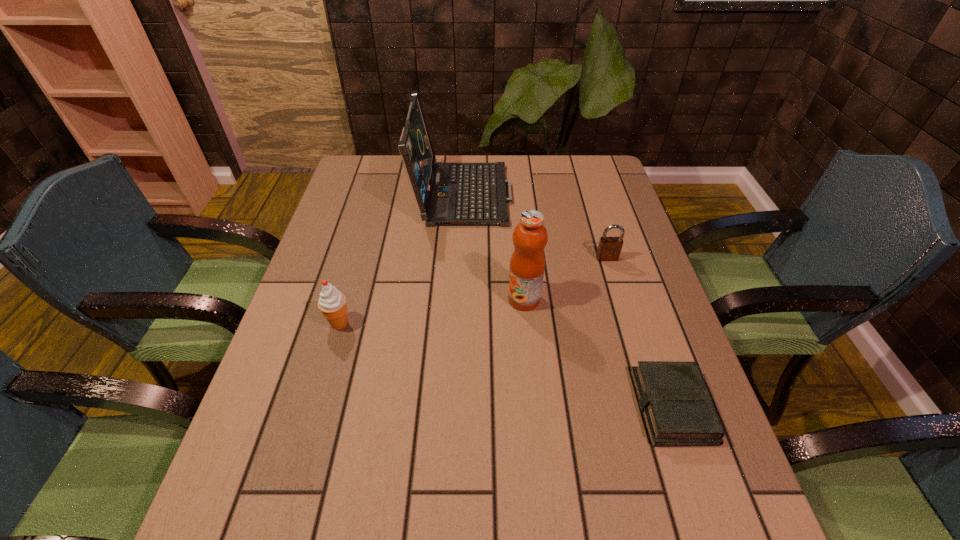
Image resolution: width=960 pixels, height=540 pixels. Find the location of `vacant region between the padlock and the shortest object`. vacant region between the padlock and the shortest object is located at coordinates (639, 333).

This screenshot has height=540, width=960. Find the location of `vacant space in between the shortest object and the farthest object`. vacant space in between the shortest object and the farthest object is located at coordinates (567, 299).

Locate an element on the screen. free space between the third farthest object and the icecream is located at coordinates [x=432, y=311].

Where is `the fourth closest object to the fruit juice`? the fourth closest object to the fruit juice is located at coordinates (332, 303).

This screenshot has width=960, height=540. Identify the location of the second closest object to the fruit juice. (678, 411).

Where is `free space that satisfies the following two spatial constraints: 1. on the back side of the shortest object; 2. on the front label of the third farthest object`? Image resolution: width=960 pixels, height=540 pixels. free space that satisfies the following two spatial constraints: 1. on the back side of the shortest object; 2. on the front label of the third farthest object is located at coordinates (636, 299).

At what (x,y) coordinates should I click in order to perform the action: click on free location that satisfies the following two spatial constraints: 1. on the front-facing side of the fourth nearest object; 2. on the front label of the fruit juice. Please return your answer as a coordinate pair (x, y). Looking at the image, I should click on (619, 299).

This screenshot has width=960, height=540. What are the coordinates of `free space in the image that satisfies the following two spatial constraints: 1. on the front-facing side of the second shortest object; 2. on the left side of the nearest object` in the screenshot? It's located at (652, 407).

Identify the location of free space that satisfies the following two spatial constraints: 1. on the back side of the shortest object; 2. on the front label of the fruit juice. (636, 299).

The image size is (960, 540). I want to click on free point that satisfies the following two spatial constraints: 1. on the front-facing side of the laptop computer; 2. on the right side of the nearest object, so click(x=451, y=407).